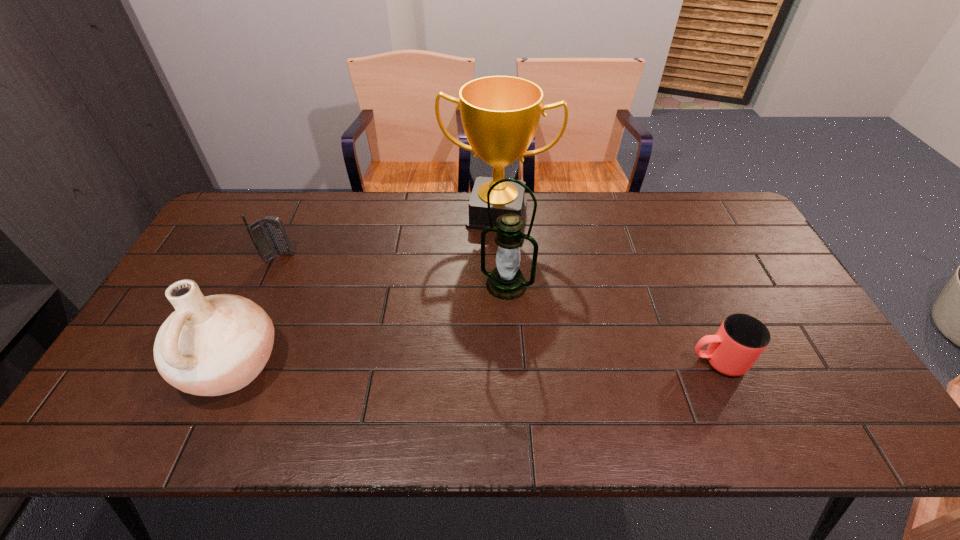
Locate an element on the screen. vacant space located 0.050m to pour from the handle of the third shortest object is located at coordinates (162, 365).

Find the location of a particular element. This screenshot has width=960, height=540. free space located on the handle side of the shortest object is located at coordinates (536, 361).

The image size is (960, 540). What are the coordinates of `free space located on the handle side of the shortest object` in the screenshot? It's located at (624, 361).

This screenshot has height=540, width=960. Find the location of `vacant space located 0.260m on the handle side of the shortest object`. vacant space located 0.260m on the handle side of the shortest object is located at coordinates (584, 361).

This screenshot has width=960, height=540. What are the coordinates of `free space located on the keyboard of the fourth tallest object` in the screenshot? It's located at (363, 305).

At what (x,y) coordinates should I click in order to perform the action: click on free space located on the keyboard of the fourth tallest object. Please return your answer as a coordinate pair (x, y). The height and width of the screenshot is (540, 960). Looking at the image, I should click on (373, 310).

The image size is (960, 540). Find the location of `free space located on the keyboard of the fourth tallest object`. free space located on the keyboard of the fourth tallest object is located at coordinates (366, 306).

Where is `vacant space positioned on the side where the second tallest object emits light`? The width and height of the screenshot is (960, 540). vacant space positioned on the side where the second tallest object emits light is located at coordinates (483, 334).

Find the location of a particular element. This screenshot has height=540, width=960. free region located on the side where the second tallest object emits light is located at coordinates (485, 328).

Where is `vacant area situated on the side where the second tallest object emits light`? This screenshot has width=960, height=540. vacant area situated on the side where the second tallest object emits light is located at coordinates (470, 361).